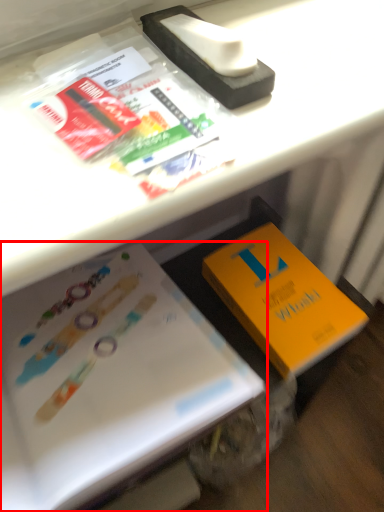
Question: Observing the image, what is the correct spatial positioning of book (annotated by the red box) in reference to book?

Choices:
 (A) right
 (B) left

Answer: (B)